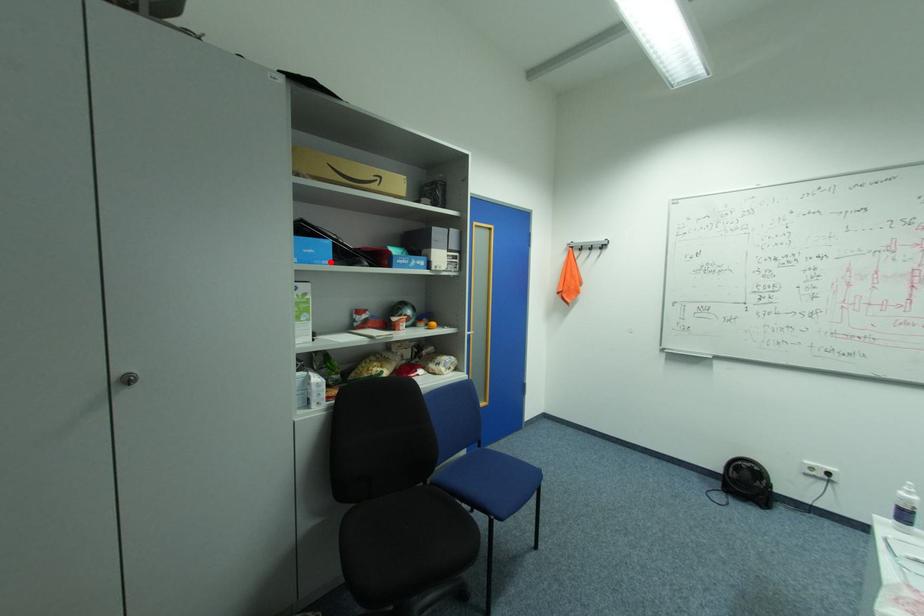
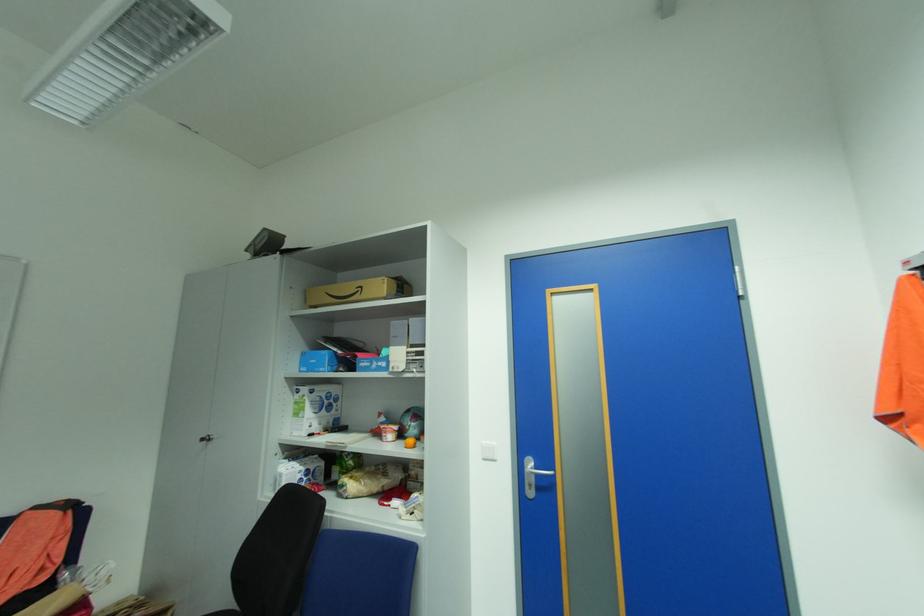
The point at the highlighted location is marked in the first image. Where is the corresponding point in the second image?

(327, 370)